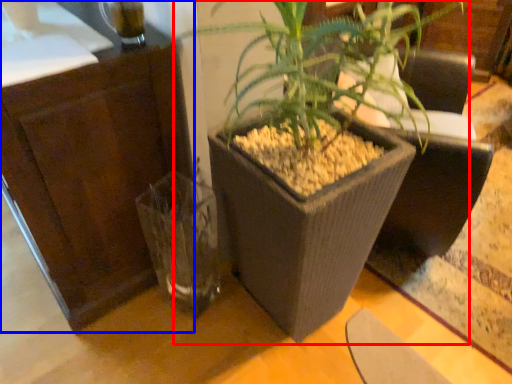
Question: Which point is closer to the camera, houseplant (highlighted by a red box) or dresser (highlighted by a blue box)?

Choices:
 (A) houseplant
 (B) dresser

Answer: (A)